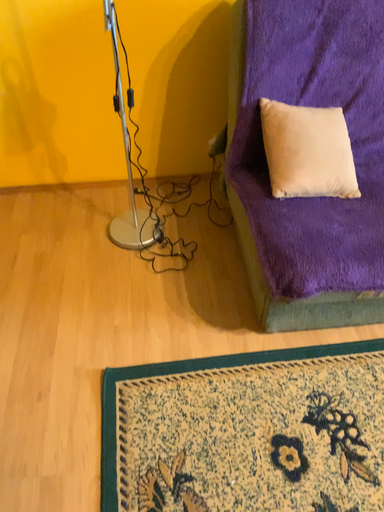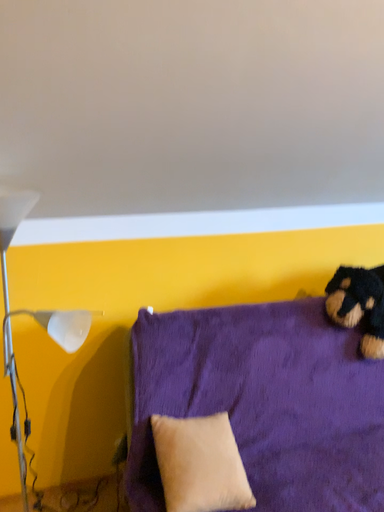
Question: Which way did the camera rotate in the video?

Choices:
 (A) rotated right
 (B) rotated left

Answer: (A)